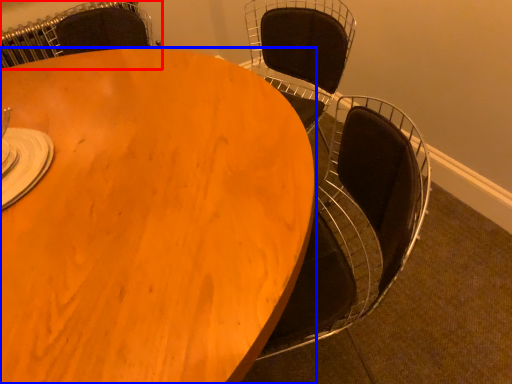
Question: Which point is closer to the camera, chair (highlighted by a red box) or table (highlighted by a blue box)?

Choices:
 (A) chair
 (B) table

Answer: (B)